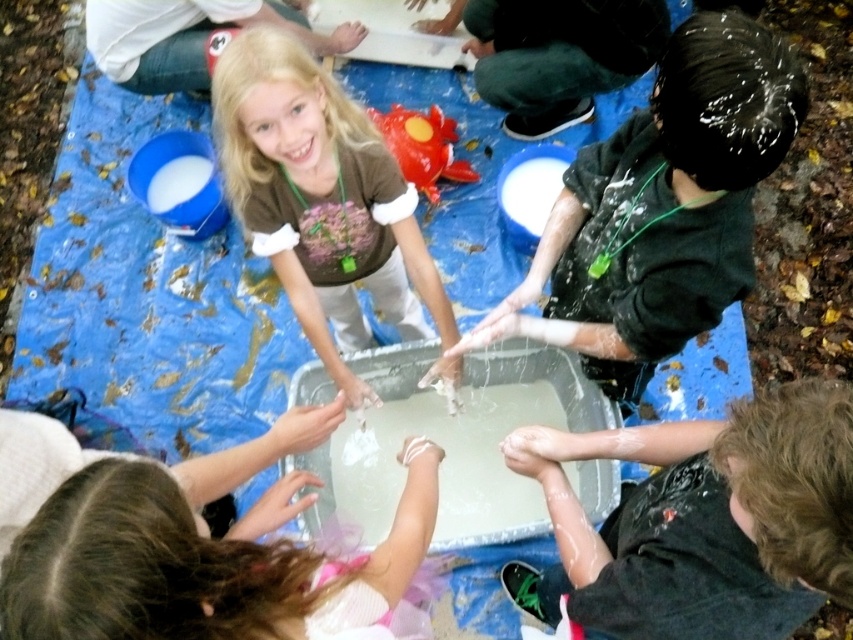
Between shiny black shirt at lower right and white matte hand at center, which one appears on the right side from the viewer's perspective?

shiny black shirt at lower right is more to the right.

Image resolution: width=853 pixels, height=640 pixels. I want to click on shiny black shirt at lower right, so click(717, 520).

Is shiny black shirt at lower right above smooth pink dress at lower left?

Indeed, shiny black shirt at lower right is positioned over smooth pink dress at lower left.

Who is taller, shiny black shirt at lower right or smooth pink dress at lower left?

With more height is shiny black shirt at lower right.

Locate an element on the screen. The width and height of the screenshot is (853, 640). shiny black shirt at lower right is located at coordinates (717, 520).

Where is `shiny black shirt at lower right`? This screenshot has height=640, width=853. shiny black shirt at lower right is located at coordinates (717, 520).

Who is more forward, (625, 195) or (223, 595)?

Point (223, 595)

How much distance is there between dark green hoodie at upper right and smooth pink dress at lower left?

dark green hoodie at upper right and smooth pink dress at lower left are 25.62 inches apart.

Who is more distant from viewer, (619, 189) or (111, 632)?

Point (619, 189)

Locate an element on the screen. The height and width of the screenshot is (640, 853). dark green hoodie at upper right is located at coordinates (662, 209).